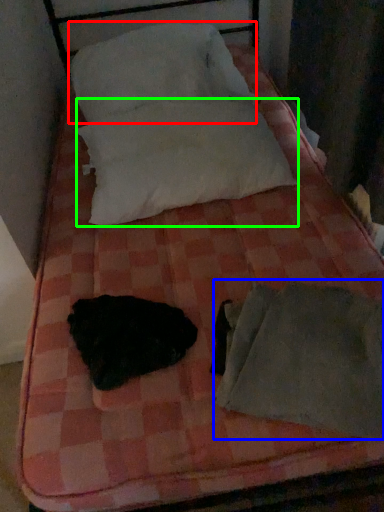
Question: Estimate the real-world distances between objects in this image. Which object is farther from pillow (highlighted by a red box), sleeping bag (highlighted by a blue box) or pillow (highlighted by a green box)?

Choices:
 (A) sleeping bag
 (B) pillow

Answer: (A)